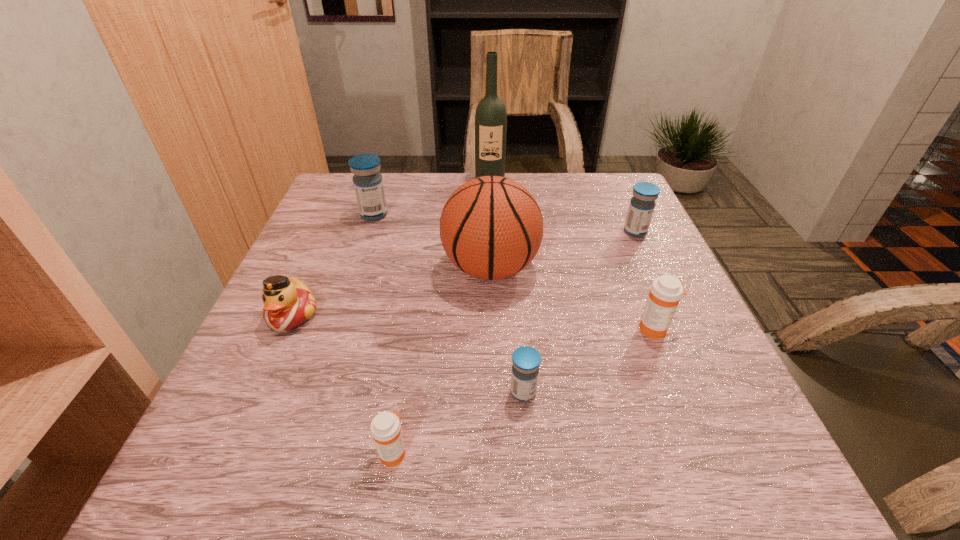
Where is `medicine that is the closest to the bigger orange medicine`? The height and width of the screenshot is (540, 960). medicine that is the closest to the bigger orange medicine is located at coordinates click(526, 360).

The image size is (960, 540). In order to click on medicine that stands as the closest to the wine bottle in this screenshot , I will do `click(368, 184)`.

Choose which blue medicine is the nearest neighbor to the seventh object from right to left. Please provide its 2D coordinates. Your answer should be formatted as a tuple, i.e. [(x, y)], where the tuple contains the x and y coordinates of a point satisfying the conditions above.

[(526, 360)]

Select which blue medicine appears as the third closest to the nearest object. Please provide its 2D coordinates. Your answer should be formatted as a tuple, i.e. [(x, y)], where the tuple contains the x and y coordinates of a point satisfying the conditions above.

[(642, 204)]

In order to click on vacant space that satisfies the following two spatial constraints: 1. on the side where the inflation valve is located; 2. on the left side of the third nearest medicine in this screenshot , I will do `click(492, 329)`.

Locate an element on the screen. The width and height of the screenshot is (960, 540). vacant space that satisfies the following two spatial constraints: 1. on the labeled side of the green wine bottle; 2. on the right side of the smallest blue medicine is located at coordinates (497, 392).